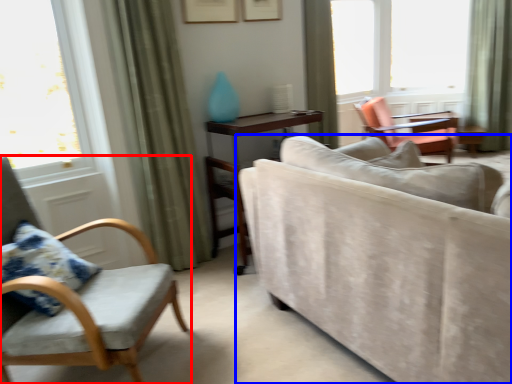
Question: Which object is closer to the camera taking this photo, chair (highlighted by a red box) or studio couch (highlighted by a blue box)?

Choices:
 (A) chair
 (B) studio couch

Answer: (B)